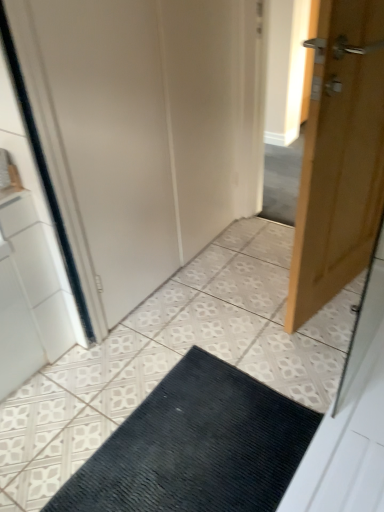
Describe the element at coordinates (196, 447) in the screenshot. I see `black textured mat at center` at that location.

This screenshot has width=384, height=512. What do you see at coordinates (340, 157) in the screenshot?
I see `light brown wooden door at right` at bounding box center [340, 157].

Locate an element on the screen. The image size is (384, 512). white matte door at center is located at coordinates (103, 140).

From the picture: From the image's perspective, is light brown wooden door at right beneath white matte door at center?

Correct, light brown wooden door at right appears lower than white matte door at center in the image.

Can you tell me how much light brown wooden door at right and white matte door at center differ in facing direction?

The angular difference between light brown wooden door at right and white matte door at center is 169 degrees.

Which is closer, (x=315, y=244) or (x=82, y=111)?

Point (x=315, y=244) appears to be farther away from the viewer than point (x=82, y=111).

How distant is light brown wooden door at right from white matte door at center?

25.44 inches.

Can you confirm if black textured mat at center is positioned to the left of light brown wooden door at right?

Yes.

Is black textured mat at center not near light brown wooden door at right?

No, there isn't a large distance between black textured mat at center and light brown wooden door at right.

Does black textured mat at center have a lesser height compared to light brown wooden door at right?

Yes.

Can you confirm if black textured mat at center is smaller than light brown wooden door at right?

Correct, black textured mat at center occupies less space than light brown wooden door at right.

How many degrees apart are the facing directions of light brown wooden door at right and black textured mat at center?

The angle between the facing direction of light brown wooden door at right and the facing direction of black textured mat at center is 80 degrees.

Identify the location of door above the black textured mat at center (from a real-world perspective). The width and height of the screenshot is (384, 512). (340, 157).

Consider the image. From a real-world perspective, who is located higher, light brown wooden door at right or black textured mat at center?

light brown wooden door at right, from a real-world perspective.

Based on the photo, measure the distance between white matte door at center and black textured mat at center.

The distance of white matte door at center from black textured mat at center is 28.21 inches.

This screenshot has height=512, width=384. Find the location of `doormat that appears below the white matte door at center (from the image's perspective)`. doormat that appears below the white matte door at center (from the image's perspective) is located at coordinates (196, 447).

Is white matte door at center positioned beyond the bounds of black textured mat at center?

Yes, white matte door at center is not within black textured mat at center.

Considering the sizes of objects white matte door at center and black textured mat at center in the image provided, who is smaller, white matte door at center or black textured mat at center?

black textured mat at center is smaller.

From the image's perspective, between black textured mat at center and white matte door at center, which one is located above?

white matte door at center appears higher in the image.

From a real-world perspective, is black textured mat at center physically located above or below white matte door at center?

From a real-world perspective, black textured mat at center is physically below white matte door at center.

Does black textured mat at center appear on the right side of white matte door at center?

Correct, you'll find black textured mat at center to the right of white matte door at center.

Is black textured mat at center oriented towards white matte door at center?

No, black textured mat at center is not facing towards white matte door at center.

From a real-world perspective, between white matte door at center and light brown wooden door at right, who is vertically lower?

light brown wooden door at right, from a real-world perspective.

Is white matte door at center placed right next to light brown wooden door at right?

No, white matte door at center is not touching light brown wooden door at right.

Which of these two, white matte door at center or light brown wooden door at right, is smaller?

light brown wooden door at right.

Is white matte door at center in front of or behind light brown wooden door at right in the image?

white matte door at center is positioned farther from the viewer than light brown wooden door at right.

This screenshot has height=512, width=384. Identify the location of door on the right of white matte door at center. (340, 157).

Where is `door lying behind the black textured mat at center`? door lying behind the black textured mat at center is located at coordinates (340, 157).

From the image, which object appears to be nearer to black textured mat at center, light brown wooden door at right or white matte door at center?

light brown wooden door at right is positioned closer to the anchor black textured mat at center.

From the image, which object appears to be nearer to white matte door at center, black textured mat at center or light brown wooden door at right?

light brown wooden door at right lies closer to white matte door at center than the other object.

Considering their positions, is white matte door at center positioned closer to black textured mat at center than light brown wooden door at right?

light brown wooden door at right is positioned closer to the anchor black textured mat at center.

Looking at the image, which one is located further to light brown wooden door at right, white matte door at center or black textured mat at center?

The object further to light brown wooden door at right is black textured mat at center.

Estimate the real-world distances between objects in this image. Which object is closer to white matte door at center, light brown wooden door at right or black textured mat at center?

The object closer to white matte door at center is light brown wooden door at right.

Based on the photo, when comparing their distances from light brown wooden door at right, does black textured mat at center or white matte door at center seem closer?

Among the two, white matte door at center is located nearer to light brown wooden door at right.

You are a GUI agent. You are given a task and a screenshot of the screen. Output one action in this format:
    pyautogui.click(x=<x>, y=<y>)
    Task: Click on the door between white matte door at center and black textured mat at center in the vertical direction
    This screenshot has height=512, width=384.
    Given the screenshot: What is the action you would take?
    pyautogui.click(x=340, y=157)